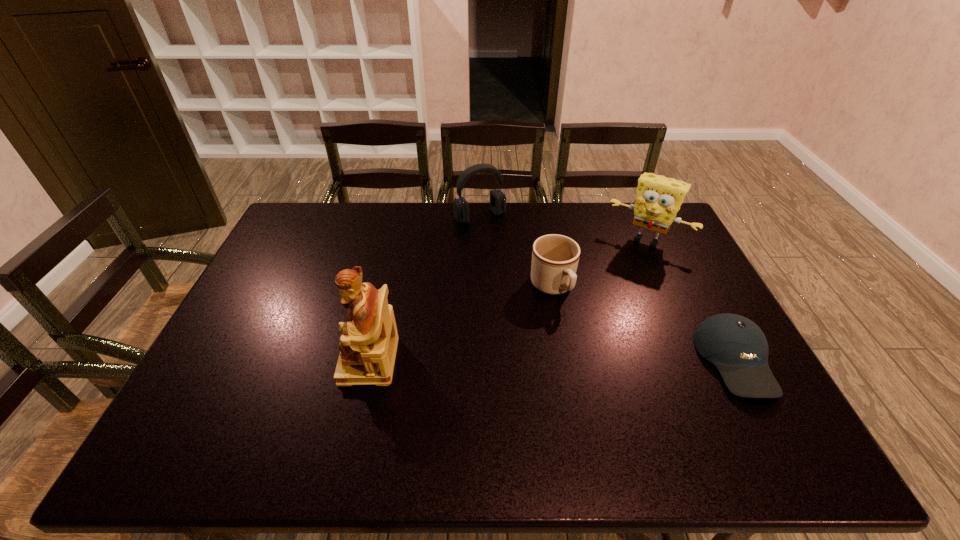
Find the location of `sponge located in the far edge section of the desktop`. sponge located in the far edge section of the desktop is located at coordinates (658, 199).

Find the location of a particular element. Image resolution: width=960 pixels, height=540 pixels. figurine that is at the near edge is located at coordinates (368, 345).

The height and width of the screenshot is (540, 960). Find the location of `baseball cap that is at the near edge`. baseball cap that is at the near edge is located at coordinates (738, 348).

Identify the location of baseball cap at the right edge. (738, 348).

This screenshot has height=540, width=960. What are the coordinates of `sponge located at the right edge` in the screenshot? It's located at (658, 199).

Where is `object located in the far right corner section of the desktop`? object located in the far right corner section of the desktop is located at coordinates point(658,199).

Find the location of a particular element. This screenshot has height=540, width=960. object that is positioned at the near right corner is located at coordinates (738, 348).

The image size is (960, 540). I want to click on free space at the far edge, so click(x=501, y=234).

At what (x,y) coordinates should I click in order to perform the action: click on vacant space at the near edge of the desktop. Please return your answer as a coordinate pair (x, y). Image resolution: width=960 pixels, height=540 pixels. Looking at the image, I should click on (318, 410).

Find the location of a particular element. vacant space at the left edge of the desktop is located at coordinates pyautogui.click(x=259, y=363).